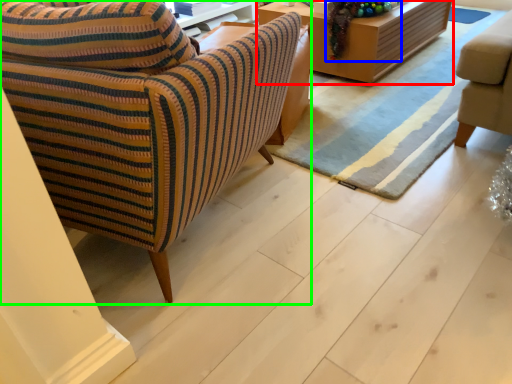
Question: Based on their relative distances, which object is farther from table (highlighted by a red box)? Choose from christmas decoration (highlighted by a blue box) and chair (highlighted by a green box).

Choices:
 (A) christmas decoration
 (B) chair

Answer: (B)